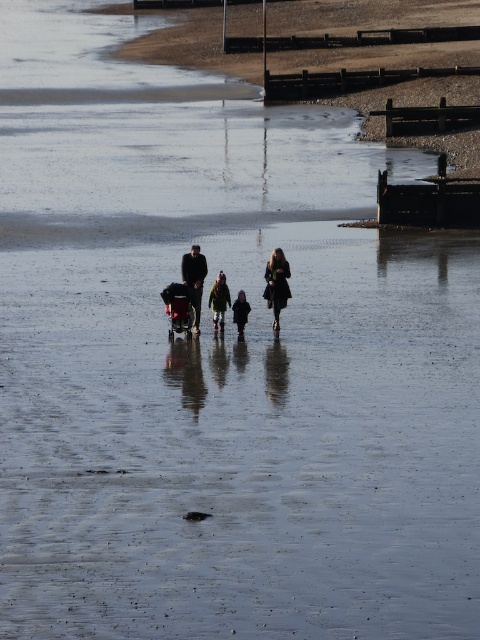
Who is positioned more to the left, dark brown leather coat at center or green fabric jacket at center?

green fabric jacket at center

The height and width of the screenshot is (640, 480). What are the coordinates of `dark brown leather coat at center` in the screenshot? It's located at (276, 284).

Locate an element on the screen. The width and height of the screenshot is (480, 640). dark brown leather coat at center is located at coordinates (276, 284).

Does green fabric jacket at center have a larger size compared to dark blue coat at center?

Yes.

Is point (214, 321) closer to viewer compared to point (231, 305)?

No, it is behind (231, 305).

Locate an element on the screen. Image resolution: width=480 pixels, height=640 pixels. green fabric jacket at center is located at coordinates (218, 300).

Where is `green fabric jacket at center`? This screenshot has height=640, width=480. green fabric jacket at center is located at coordinates (218, 300).

Is point (192, 301) behind point (197, 276)?

No, (192, 301) is in front of (197, 276).

Who is positioned more to the right, metallic silver baby carriage at center or dark fabric jacket at center?

dark fabric jacket at center is more to the right.

Find the location of a particular element. This screenshot has width=480, height=640. metallic silver baby carriage at center is located at coordinates (178, 307).